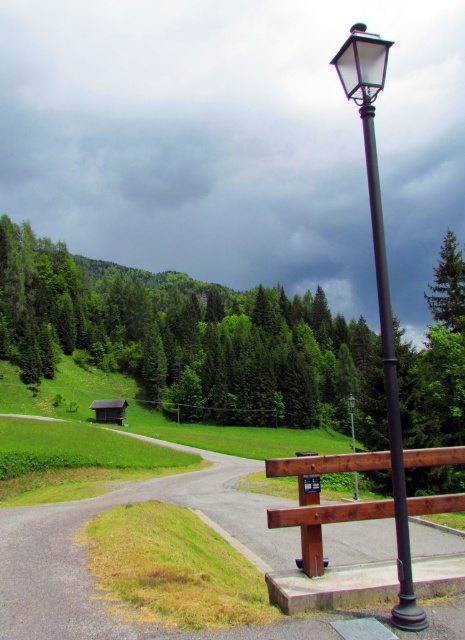
Question: Can you confirm if brown wooden bench at center is positioned above black metal pole at center?

Choices:
 (A) no
 (B) yes

Answer: (A)

Question: Is the position of green matte tree at upper center more distant than that of matte black street light at upper right?

Choices:
 (A) yes
 (B) no

Answer: (B)

Question: Which object is farther from the camera taking this photo?

Choices:
 (A) matte black street light at upper right
 (B) black metal pole at center
 (C) brown wooden hut at lower left

Answer: (C)

Question: Does asphalt road at center have a greater width compared to brown wooden bench at center?

Choices:
 (A) no
 (B) yes

Answer: (B)

Question: Which point is farther to the camera?

Choices:
 (A) black metal pole at center
 (B) brown wooden hut at lower left
 (C) asphalt road at center
 (D) green matte tree at upper center

Answer: (B)

Question: Estimate the real-world distances between objects in this image. Which object is farther from the black metal pole at center?

Choices:
 (A) brown wooden hut at lower left
 (B) brown wooden bench at center

Answer: (B)